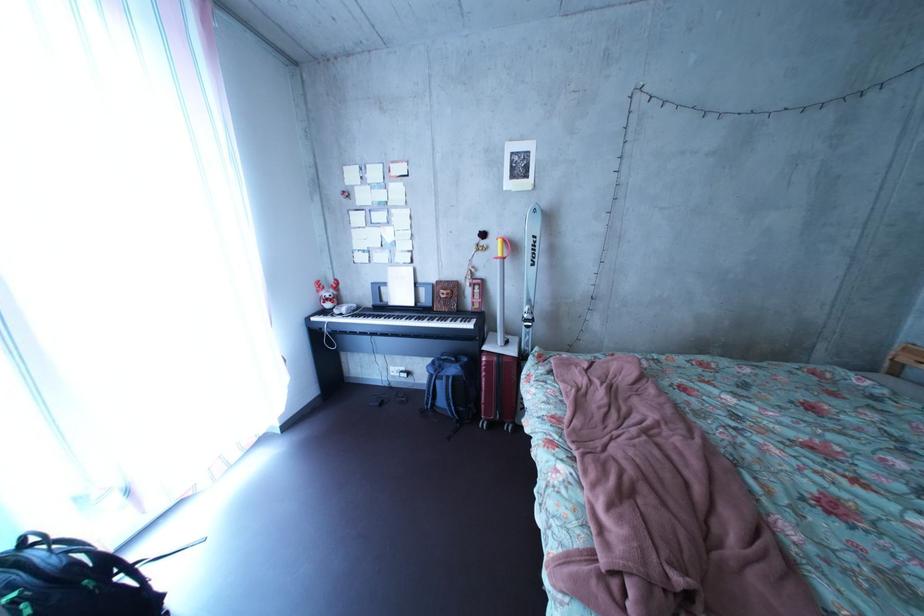
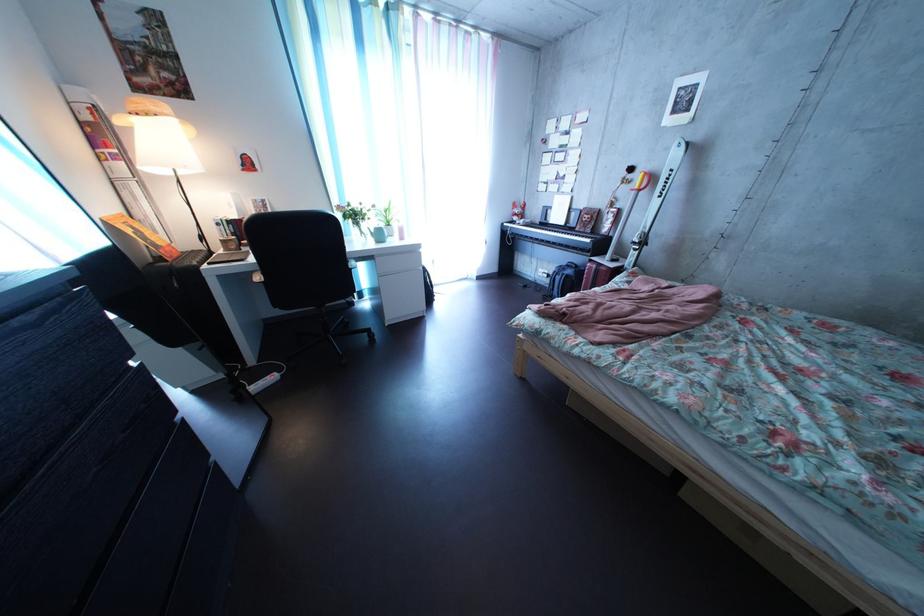
Find the pixel in the second image that matches pixel 427 313 in the first image.

(577, 232)